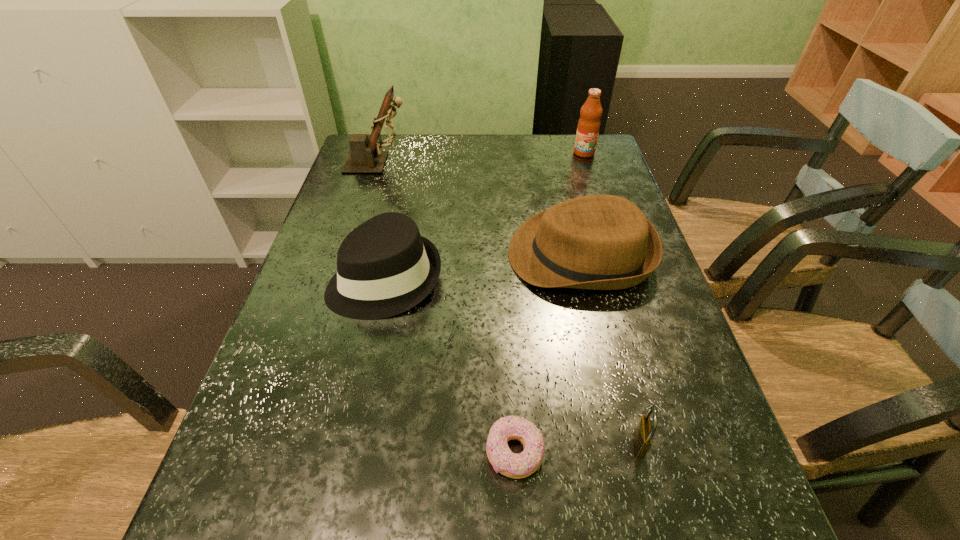
Find the location of a particular element. Image resolution: width=960 pixels, height=540 pixels. figurine is located at coordinates pyautogui.click(x=366, y=156).

I want to click on fruit juice, so click(x=588, y=127).

This screenshot has width=960, height=540. I want to click on the left fedora, so click(385, 267).

Where is `the right fedora`? This screenshot has height=540, width=960. the right fedora is located at coordinates (600, 242).

Identify the location of padlock. (643, 434).

Image resolution: width=960 pixels, height=540 pixels. I want to click on the shortest object, so click(x=512, y=465).

I want to click on vacant space located on the front-facing side of the tallest object, so click(473, 163).

Find the location of `free location located on the front label of the second tallest object`. free location located on the front label of the second tallest object is located at coordinates (590, 173).

Find the location of a particular element. blank space located on the front of the left fedora is located at coordinates (353, 432).

You are a GUI agent. You are given a task and a screenshot of the screen. Output one action in this format:
    pyautogui.click(x=<x>, y=<y>)
    Task: Click on the free space located 0.060m on the front-facing side of the right fedora
    Image resolution: width=960 pixels, height=540 pixels.
    Given the screenshot: What is the action you would take?
    pyautogui.click(x=484, y=255)